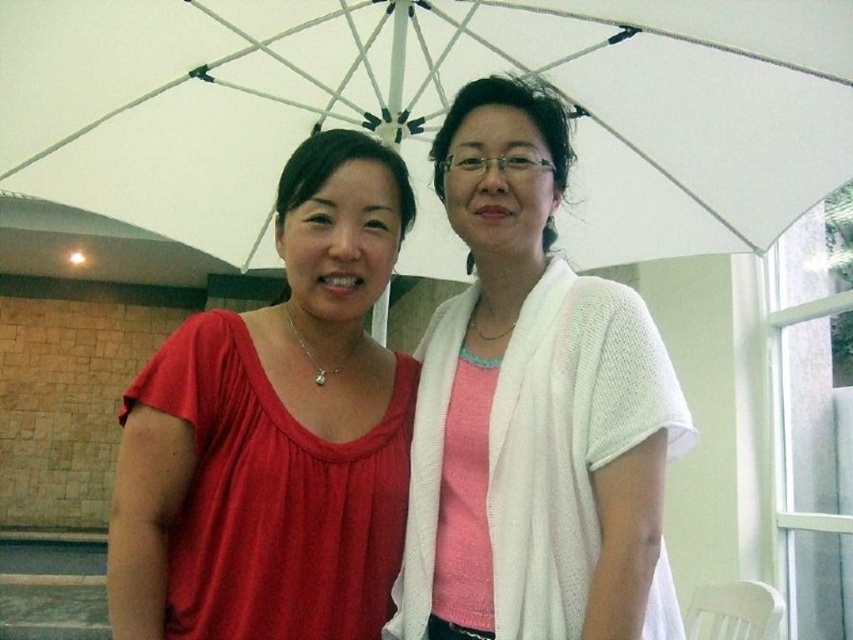
You are trying to locate the white knitted sweater at center in the image. According to the coordinates provided, where exactly is it positioned?

The white knitted sweater at center is located at point coordinates of (532, 412).

Looking at this image, you are a photographer setting up a shot. You need to ensure that the white fabric umbrella at upper center doesn not block the white knitted sweater at center. Based on the scene description, can you determine if the umbrella is wide enough to potentially cover the sweater?

The white fabric umbrella at upper center might be wider than the white knitted sweater at center, so there is a possibility that the umbrella could cover the sweater if positioned appropriately.